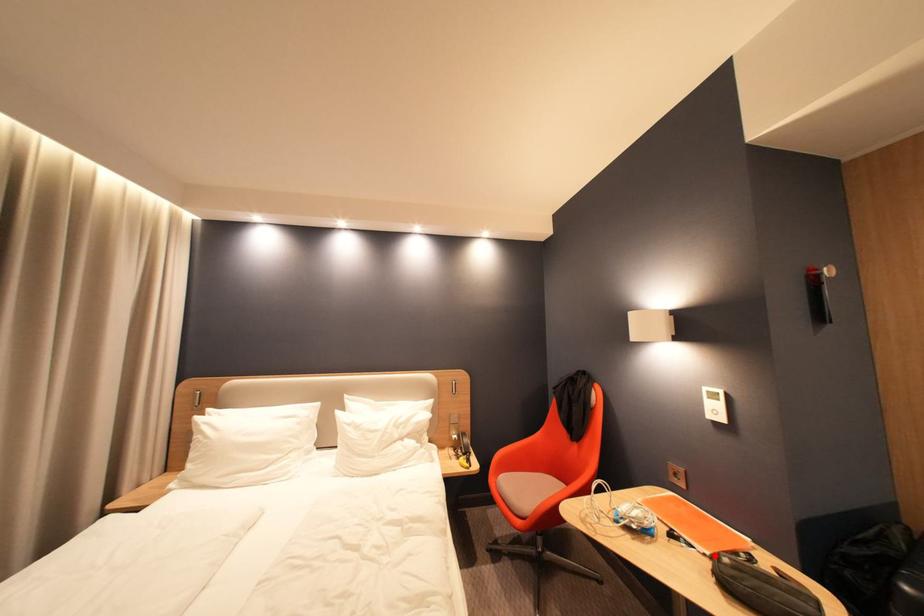
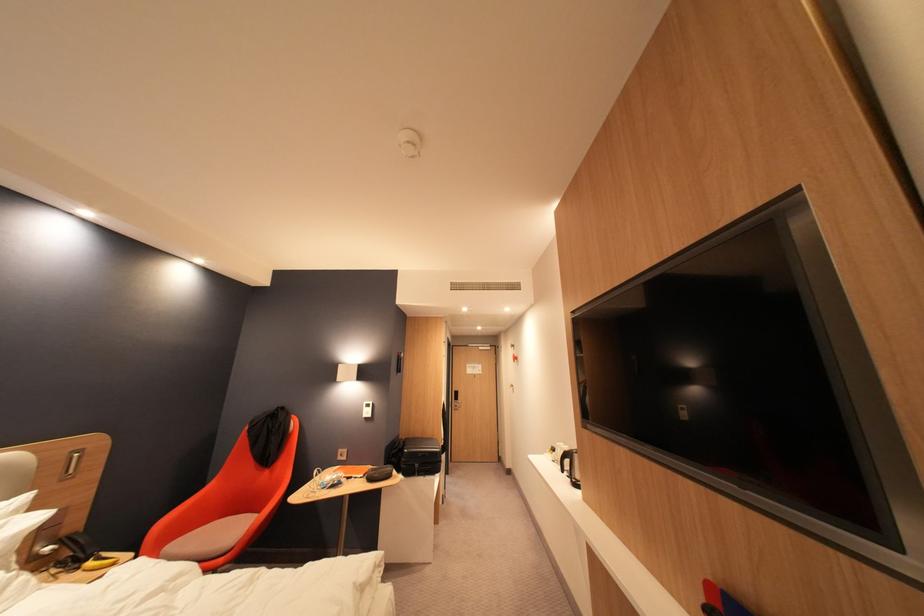
Question: A red point is marked in image1. In image2, is the corresponding 3D point closer to the camera or farther? Reply with the corresponding letter.

Choices:
 (A) The corresponding 3D point is closer.
 (B) The corresponding 3D point is farther.

Answer: (B)